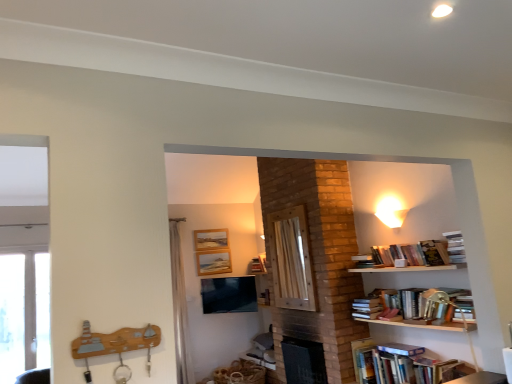
Question: Is transparent glass door at left taller or shorter than wooden screen door at center?

Choices:
 (A) short
 (B) tall

Answer: (B)

Question: Does point (10, 322) appear closer or farther from the camera than point (309, 273)?

Choices:
 (A) closer
 (B) farther

Answer: (B)

Question: Estimate the real-world distances between objects in this image. Which object is farther from the wooden picture frame at upper center, marked as the second picture frame in a top-to-bottom arrangement?

Choices:
 (A) translucent fabric curtain at center
 (B) transparent glass door at left
 (C) matte black tv at center
 (D) hardcover books at lower right, marked as the 2th book in a top-to-bottom arrangement
 (E) wooden screen door at center

Answer: (D)

Question: Which of these objects is positioned closest to the translucent fabric curtain at center?

Choices:
 (A) wooden screen door at center
 (B) matte black tv at center
 (C) hardcover books at lower right, marked as the 1th book in a bottom-to-top arrangement
 (D) wooden picture frame at upper center, the first picture frame from the top
 (E) hardcover books at upper right, acting as the second book starting from the bottom

Answer: (B)